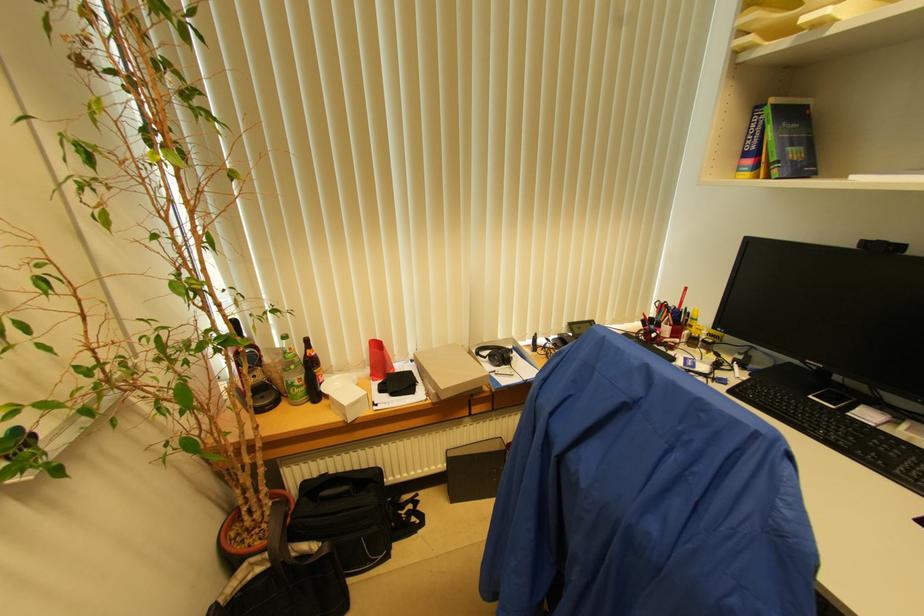
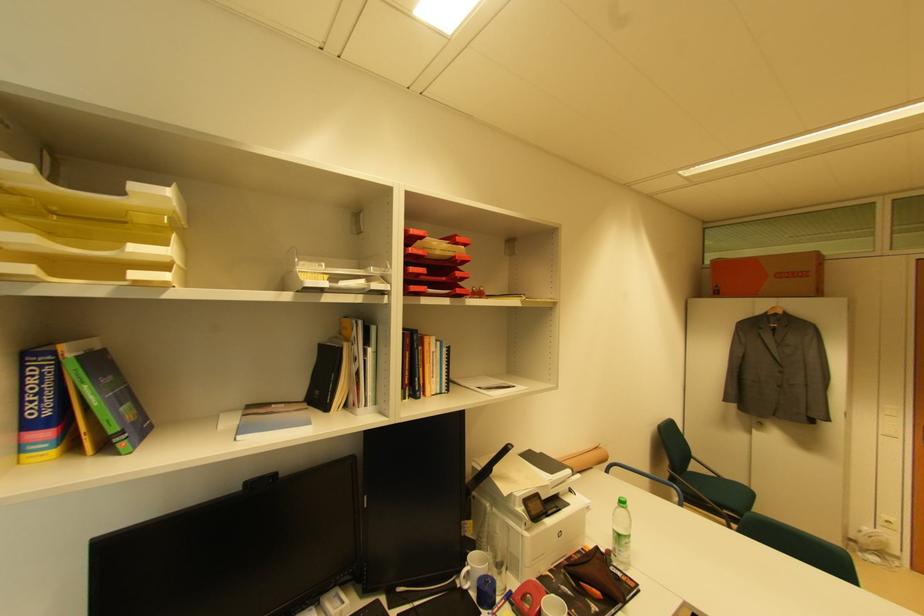
Question: The first image is from the beginning of the video and the second image is from the end. How did the camera likely rotate when shooting the video?

Choices:
 (A) Left
 (B) Right
 (C) Up
 (D) Down

Answer: (B)